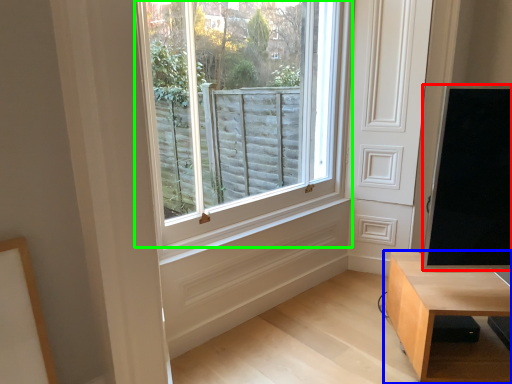
Question: Estimate the real-world distances between objects in this image. Which object is farther from window screen (highlighted by a red box), table (highlighted by a blue box) or window (highlighted by a green box)?

Choices:
 (A) table
 (B) window

Answer: (B)